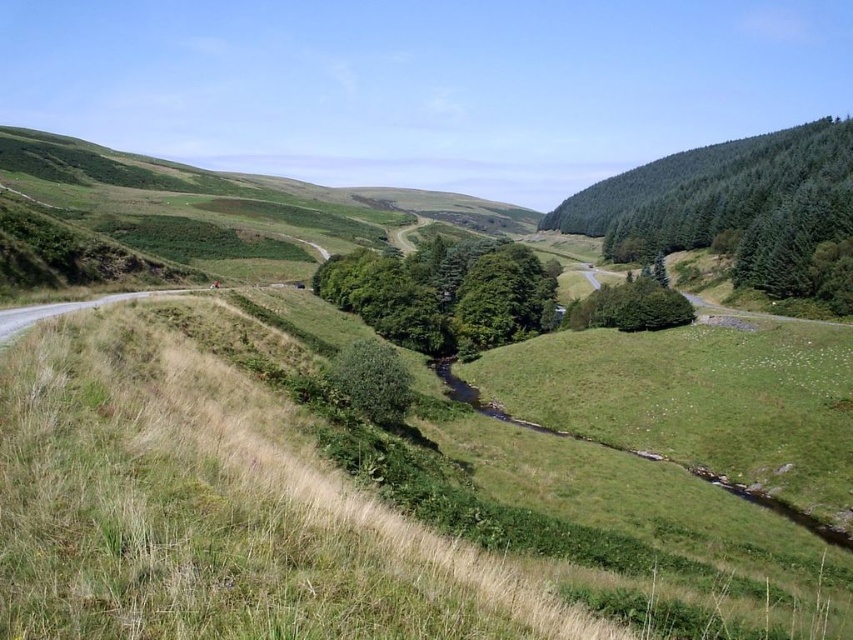
Between green coniferous forest at upper right and green leafy tree at center, which one appears on the left side from the viewer's perspective?

Positioned to the left is green leafy tree at center.

Is green coniferous forest at upper right positioned before green leafy tree at center?

Yes, it is in front of green leafy tree at center.

The width and height of the screenshot is (853, 640). What do you see at coordinates (729, 205) in the screenshot?
I see `green coniferous forest at upper right` at bounding box center [729, 205].

Locate an element on the screen. Image resolution: width=853 pixels, height=640 pixels. green coniferous forest at upper right is located at coordinates (729, 205).

Between green grassy at left and green grassy hillside at upper left, which one appears on the right side from the viewer's perspective?

Positioned to the right is green grassy at left.

The width and height of the screenshot is (853, 640). Describe the element at coordinates (334, 515) in the screenshot. I see `green grassy at left` at that location.

Where is `green grassy at left`? green grassy at left is located at coordinates (334, 515).

Can you confirm if green coniferous forest at upper right is bigger than green leafy bush at center?

Yes, green coniferous forest at upper right is bigger than green leafy bush at center.

Does point (555, 214) lie in front of point (347, 380)?

No, (555, 214) is further to viewer.

This screenshot has height=640, width=853. What are the coordinates of `green coniferous forest at upper right` in the screenshot? It's located at (729, 205).

The width and height of the screenshot is (853, 640). In order to click on green coniferous forest at upper right in this screenshot , I will do `click(729, 205)`.